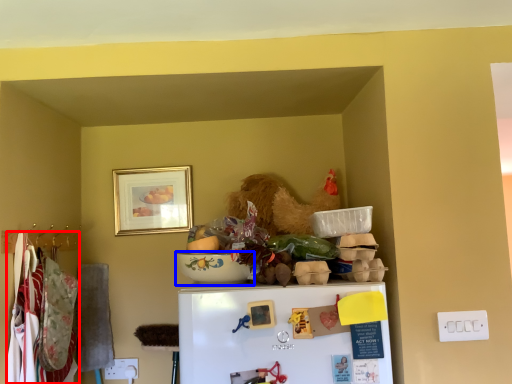
Question: Which point is closer to the camera, laundry (highlighted by a red box) or bowl (highlighted by a blue box)?

Choices:
 (A) laundry
 (B) bowl

Answer: (B)